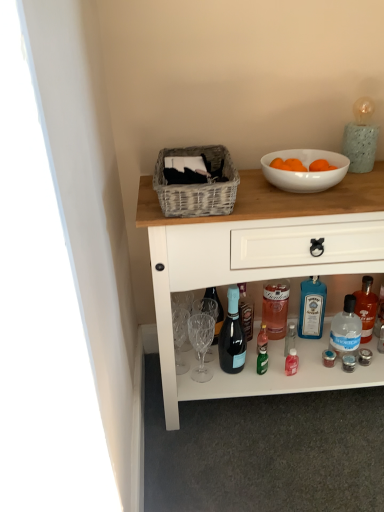
Question: In the image, is clear plastic bottle at lower right, the first bottle positioned from the right, on the left side or the right side of transparent plastic bottle at lower right, the second bottle viewed from the left?

Choices:
 (A) left
 (B) right

Answer: (B)

Question: Based on their sizes in the image, would you say clear plastic bottle at lower right, the first bottle positioned from the right, is bigger or smaller than transparent plastic bottle at lower right, the second bottle viewed from the left?

Choices:
 (A) small
 (B) big

Answer: (B)

Question: Considering the real-world distances, which object is closest to the matte black wine bottle at center?

Choices:
 (A) blue glass bottle at lower center, marked as the 1th bottle in a left-to-right arrangement
 (B) white wood desk at center
 (C) transparent plastic bottle at lower right, the second bottle viewed from the left
 (D) clear plastic bottle at lower right, the first bottle positioned from the right
 (E) woven gray picnic basket at upper center

Answer: (A)

Question: Estimate the real-world distances between objects in this image. Which object is farther from the transparent plastic bottle at lower right, the 2th bottle in the right-to-left sequence?

Choices:
 (A) white glossy bowl at upper right
 (B) white wood desk at center
 (C) clear plastic bottle at lower right, which appears as the 3th bottle when viewed from the left
 (D) woven gray picnic basket at upper center
 (E) blue glass bottle at lower center, the third bottle from the right

Answer: (D)